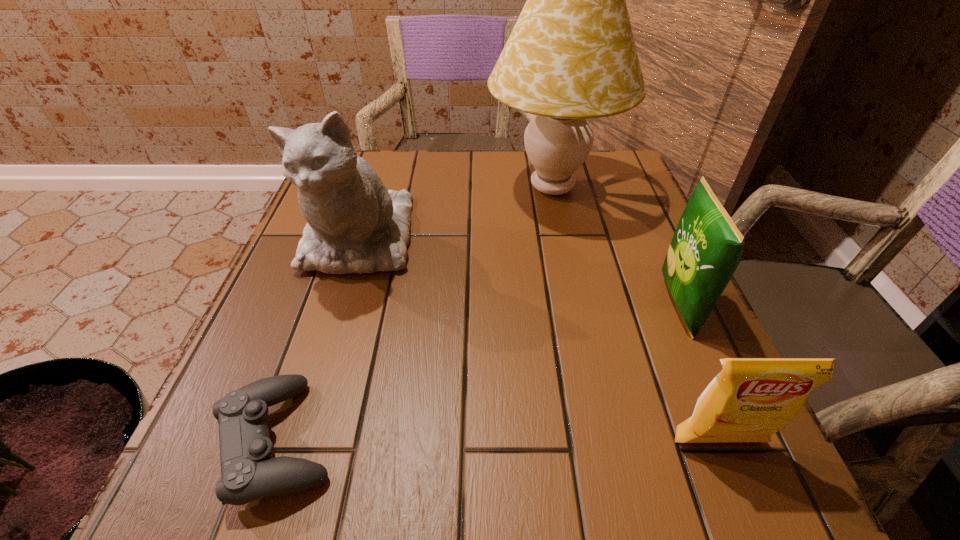
The height and width of the screenshot is (540, 960). In order to click on free space located 0.080m on the front of the nearer crisp (potato chip) with the logo in this screenshot , I will do 749,519.

You are a GUI agent. You are given a task and a screenshot of the screen. Output one action in this format:
    pyautogui.click(x=<x>, y=<y>)
    Task: Click on the free space located on the back of the control
    
    Given the screenshot: What is the action you would take?
    pyautogui.click(x=339, y=263)

This screenshot has width=960, height=540. Find the location of `lampshade that is positioned at the far edge`. lampshade that is positioned at the far edge is located at coordinates (571, 56).

I want to click on cat located in the far edge section of the desktop, so click(x=354, y=224).

This screenshot has width=960, height=540. I want to click on crisp (potato chip) at the near edge, so click(750, 399).

Locate an element on the screen. This screenshot has height=540, width=960. control that is at the near edge is located at coordinates (249, 472).

Image resolution: width=960 pixels, height=540 pixels. I want to click on cat located at the left edge, so coord(354,224).

The image size is (960, 540). Identify the location of control located at the left edge. (x=249, y=472).

Identify the location of lampshade positioned at the right edge. The image size is (960, 540). (571, 56).

The width and height of the screenshot is (960, 540). In order to click on object present at the far left corner in this screenshot , I will do tap(354, 224).